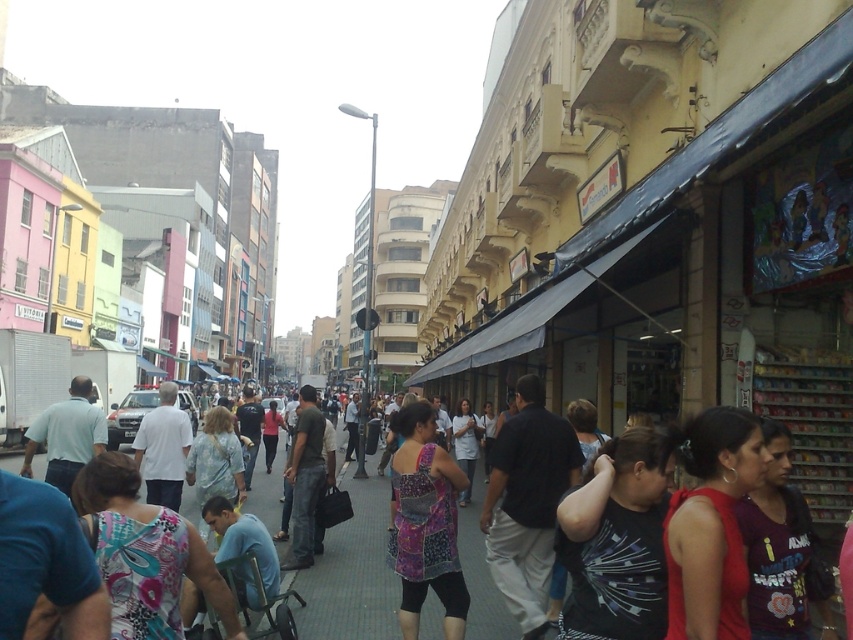
You are a fashion designer observing the urban street scene. You notice two people wearing the dark gray fabric shirt at center and the patchwork fabric dress at center. Which clothing item has a greater width when viewed from your perspective?

The dark gray fabric shirt at center has a greater width than the patchwork fabric dress at center according to the description.

You are standing on the bustling urban street scene described, and you need to walk towards both the point at coordinates (x=540, y=396) and the point at (x=408, y=422). Which point will you reach first?

You will reach point (x=540, y=396) first because it is closer to you than point (x=408, y=422), which is further away.

You are a fashion designer observing two shirts displayed in a shop window. The shirts are the printed fabric shirt at center and the dark gray fabric shirt at center. Which shirt is shorter in height?

The printed fabric shirt at center is shorter than the dark gray fabric shirt at center.